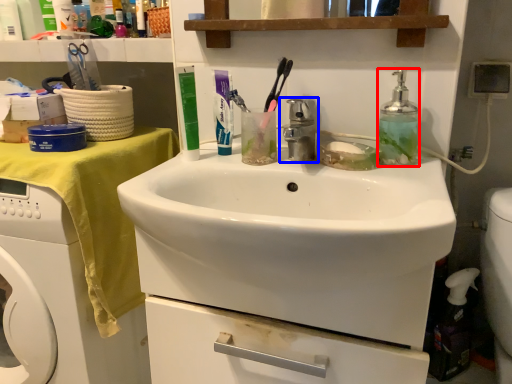
Question: Which point is closer to the camera, bottle (highlighted by a red box) or tap (highlighted by a blue box)?

Choices:
 (A) bottle
 (B) tap

Answer: (B)